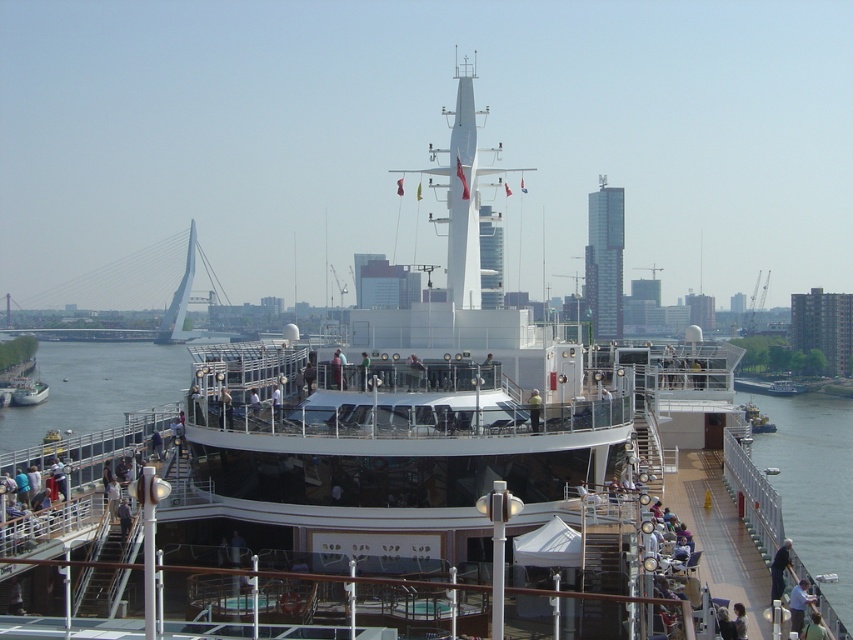
You are a passenger on the cruise ship and want to take a photo of the city skyline. You see the green water at lower right and the yellow reflective vest at center. Which object should you focus on to ensure the city skyline is visible in your photo?

The yellow reflective vest at center is on the left side of the green water at lower right, so focusing on the yellow reflective vest at center would allow the city skyline to be visible in the background.